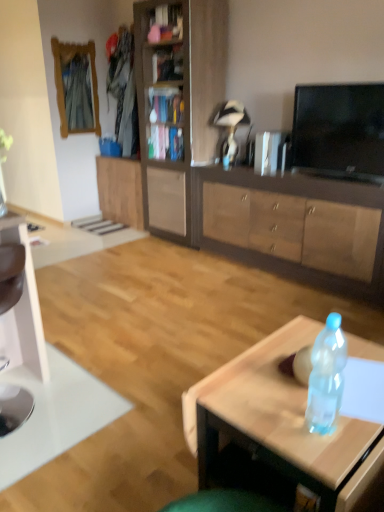
The height and width of the screenshot is (512, 384). I want to click on free point above translucent plastic bottle at center (from a real-world perspective), so click(x=300, y=380).